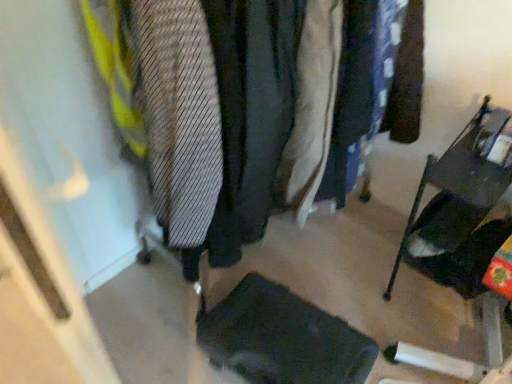
Locate an element on the screen. The image size is (512, 384). free point below light beige fabric coat at center (from a real-world perspective) is located at coordinates (286, 254).